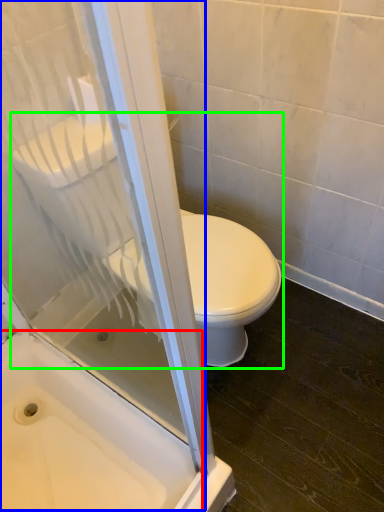
Question: Based on their relative distances, which object is nearer to bath (highlighted by a red box)? Choose from screen door (highlighted by a blue box) and toilet (highlighted by a green box).

Choices:
 (A) screen door
 (B) toilet

Answer: (A)